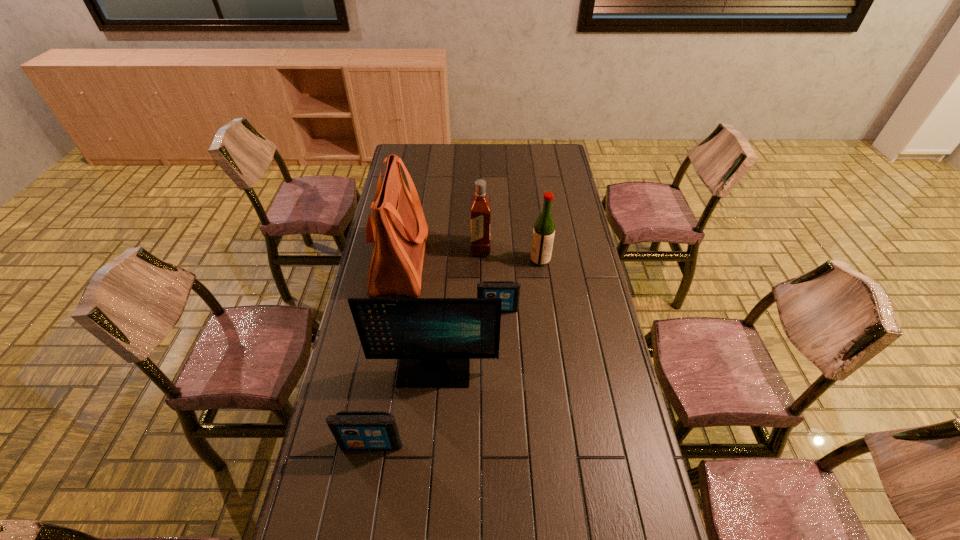
Please point a spot on the right to add another iPod. Please provide its 2D coordinates. Your answer should be formatted as a tuple, i.e. [(x, y)], where the tuple contains the x and y coordinates of a point satisfying the conditions above.

[(579, 222)]